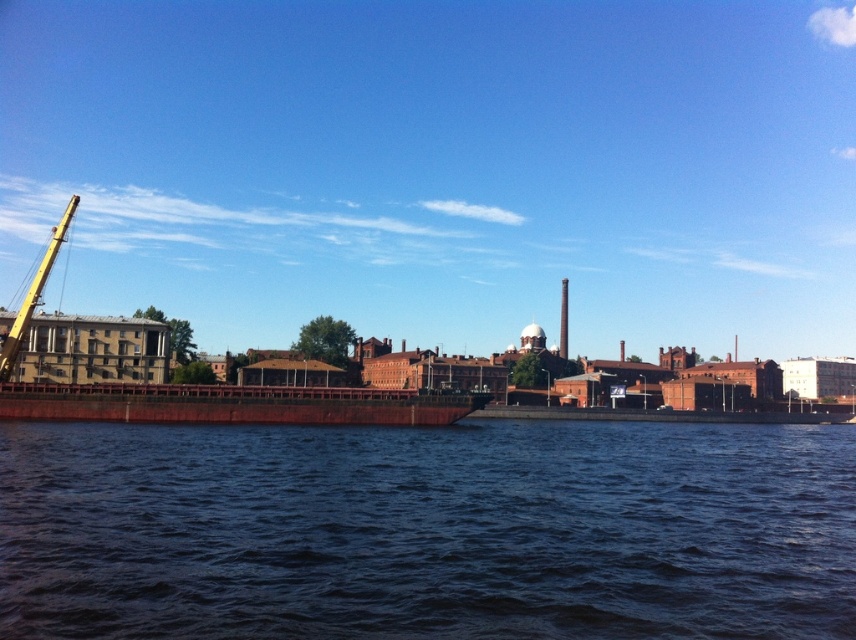
Who is positioned more to the right, dark blue water at center or yellow metallic crane at left?

dark blue water at center

Is dark blue water at center positioned behind yellow metallic crane at left?

No, dark blue water at center is closer to the viewer.

You are a GUI agent. You are given a task and a screenshot of the screen. Output one action in this format:
    pyautogui.click(x=<x>, y=<y>)
    Task: Click on the dark blue water at center
    The image size is (856, 640).
    Given the screenshot: What is the action you would take?
    pyautogui.click(x=428, y=531)

The height and width of the screenshot is (640, 856). In order to click on dark blue water at center in this screenshot , I will do `click(428, 531)`.

Who is lower down, dark blue water at center or rustic metal barge at center?

dark blue water at center is below.

Does dark blue water at center appear on the left side of rustic metal barge at center?

No, dark blue water at center is not to the left of rustic metal barge at center.

Describe the element at coordinates (428, 531) in the screenshot. The width and height of the screenshot is (856, 640). I see `dark blue water at center` at that location.

Locate an element on the screen. This screenshot has height=640, width=856. dark blue water at center is located at coordinates (428, 531).

Between point (406, 403) and point (39, 276), which one is positioned behind?

Point (39, 276)

Between rustic metal barge at center and yellow metallic crane at left, which one has more height?

Standing taller between the two is yellow metallic crane at left.

In order to click on rustic metal barge at center in this screenshot , I will do `click(233, 404)`.